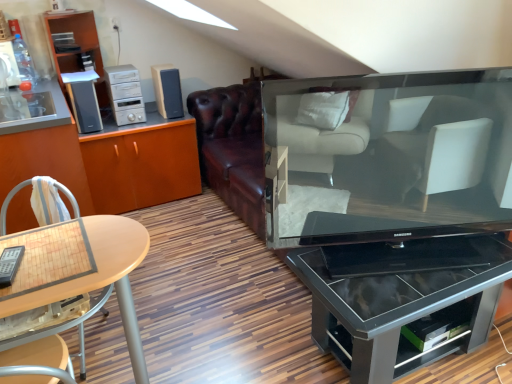
At what (x,y) coordinates should I click in order to perform the action: click on vacant area situated below black glossy television at center (from a real-world perspective). Please return your answer as a coordinate pair (x, y). This screenshot has height=384, width=512. Looking at the image, I should click on (407, 253).